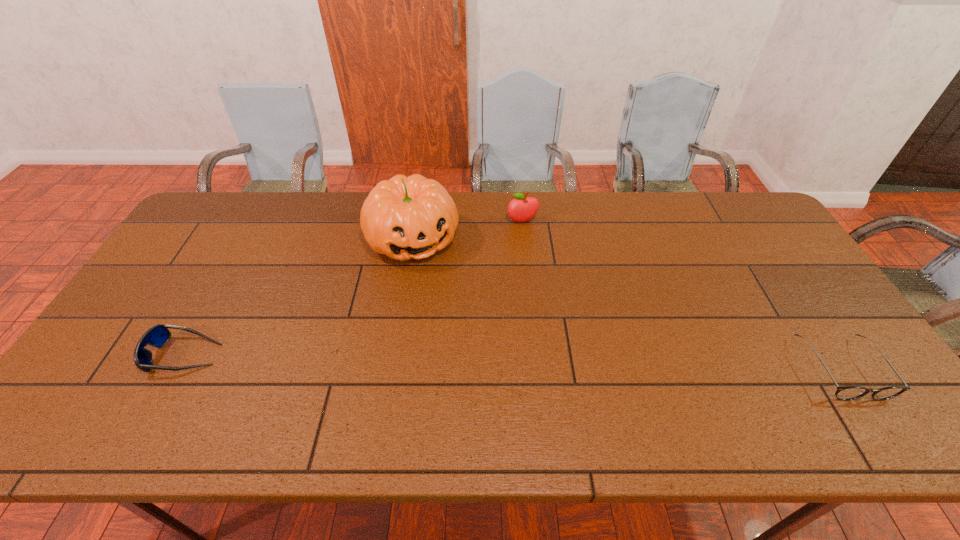
Find the location of a particular element. vacant space located on the front-facing side of the apple is located at coordinates pyautogui.click(x=541, y=290).

Locate an element on the screen. The width and height of the screenshot is (960, 540). blank area located 0.290m on the front-facing side of the apple is located at coordinates (541, 290).

Where is `free space located 0.340m on the carved face of the third object from right to left`? free space located 0.340m on the carved face of the third object from right to left is located at coordinates (471, 355).

This screenshot has height=540, width=960. I want to click on vacant region located 0.180m on the carved face of the third object from right to left, so click(x=449, y=310).

Find the location of a particular element. free spot located on the carved face of the third object from right to left is located at coordinates (464, 340).

Where is `apple located at the far edge`? apple located at the far edge is located at coordinates (521, 209).

The image size is (960, 540). Identify the location of pumpkin situated at the far edge. (404, 218).

Locate an element on the screen. This screenshot has width=960, height=540. sunglasses positioned at the near edge is located at coordinates (157, 336).

Where is `spectacles located at the near edge`? This screenshot has width=960, height=540. spectacles located at the near edge is located at coordinates (845, 393).

The height and width of the screenshot is (540, 960). Identify the location of object located in the left edge section of the desktop. (157, 336).